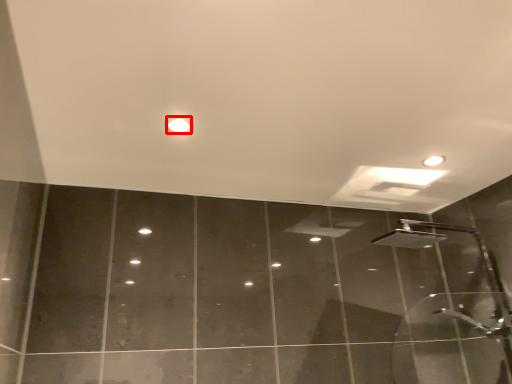
Question: Observing the image, what is the correct spatial positioning of droplight (annotated by the red box) in reference to shower?

Choices:
 (A) left
 (B) right

Answer: (A)